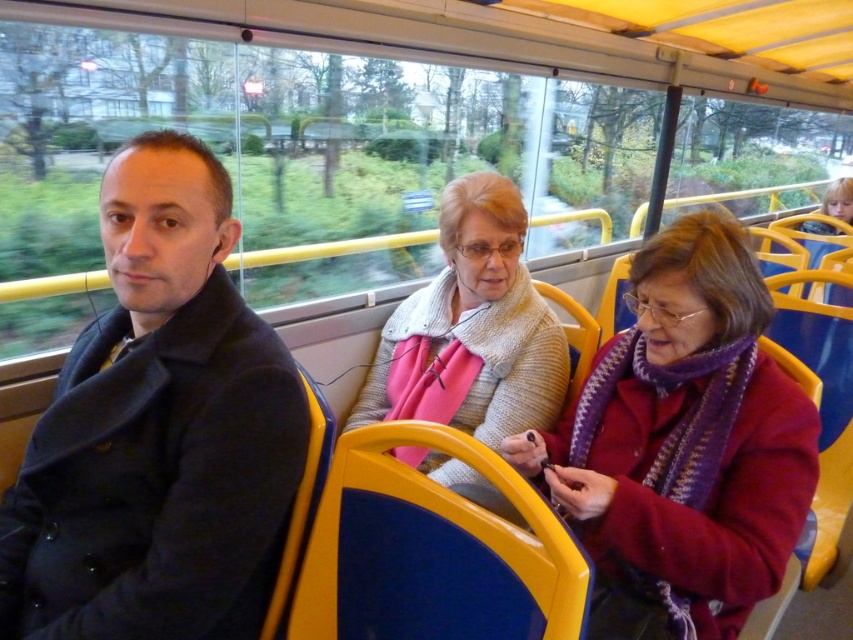
Consider the image. Does matte black coat at left appear on the right side of knitted purple scarf at center?

In fact, matte black coat at left is to the left of knitted purple scarf at center.

Is matte black coat at left above knitted purple scarf at center?

Yes, matte black coat at left is above knitted purple scarf at center.

Between point (131, 396) and point (587, 458), which one is positioned behind?

Point (587, 458)

Find the location of a particular element. matte black coat at left is located at coordinates (158, 429).

Can you confirm if knitted purple scarf at center is positioned to the left of knitted sweater at center?

In fact, knitted purple scarf at center is to the right of knitted sweater at center.

Identify the location of knitted purple scarf at center. (683, 445).

Find the location of `knitted purple scarf at center`. knitted purple scarf at center is located at coordinates (683, 445).

The width and height of the screenshot is (853, 640). Describe the element at coordinates (158, 429) in the screenshot. I see `matte black coat at left` at that location.

Which is more to the right, matte black coat at left or knitted sweater at center?

Positioned to the right is knitted sweater at center.

Locate an element on the screen. The height and width of the screenshot is (640, 853). matte black coat at left is located at coordinates (158, 429).

Image resolution: width=853 pixels, height=640 pixels. What are the coordinates of `matte black coat at left` in the screenshot? It's located at (158, 429).